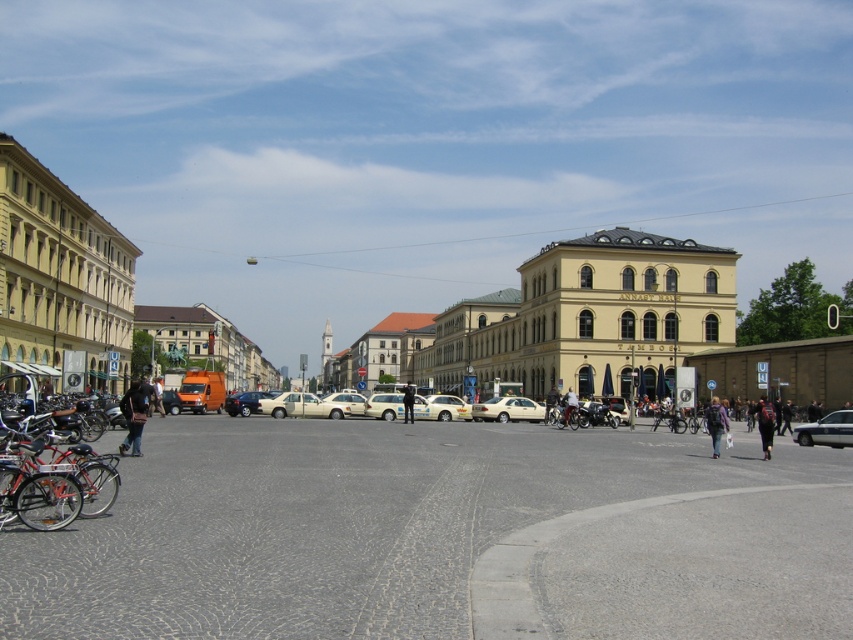
Question: Does denim jacket at lower right appear on the left side of white fabric jacket at center?

Choices:
 (A) no
 (B) yes

Answer: (A)

Question: Which point appears closest to the camera in this image?

Choices:
 (A) (10, 493)
 (B) (677, 424)
 (C) (398, 400)
 (D) (450, 417)

Answer: (A)

Question: Considering the relative positions of silver metallic sedan at lower right and dark blue jeans at center in the image provided, where is silver metallic sedan at lower right located with respect to dark blue jeans at center?

Choices:
 (A) below
 (B) above

Answer: (B)

Question: Estimate the real-world distances between objects in this image. Which object is closer to the dark blue uniform at center?

Choices:
 (A) white fabric jacket at center
 (B) silver metallic car at center
 (C) silver metallic sedan at lower right

Answer: (B)

Question: Can you confirm if dark gray backpack at lower right is bigger than dark blue uniform at center?

Choices:
 (A) no
 (B) yes

Answer: (A)

Question: Which of the following is the farthest from the observer?

Choices:
 (A) (654, 426)
 (B) (764, 432)

Answer: (A)